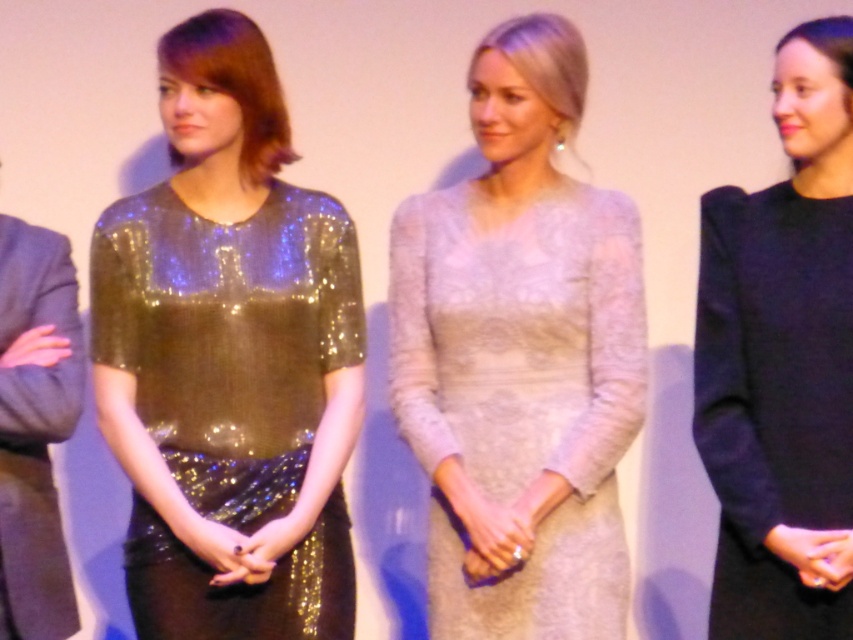
Based on the photo, you are a photographer adjusting the focus on a camera. You notice two points in the image at coordinates point (445,538) and point (705,262). Which point should you focus on first to ensure the subject closest to the camera is sharp?

Point (445,538) is further to the camera than point (705,262), so you should focus on point (445,538) first to ensure the subject closest to the camera is sharp.

You are a photographer setting up for a group photo. You have two dresses in the scene, the shiny sequined dress at center and the lace dress at center. Which dress should you focus on if you want to capture the one that takes up less space?

The shiny sequined dress at center is smaller than the lace dress at center, so you should focus on the shiny sequined dress at center to capture the one that takes up less space.